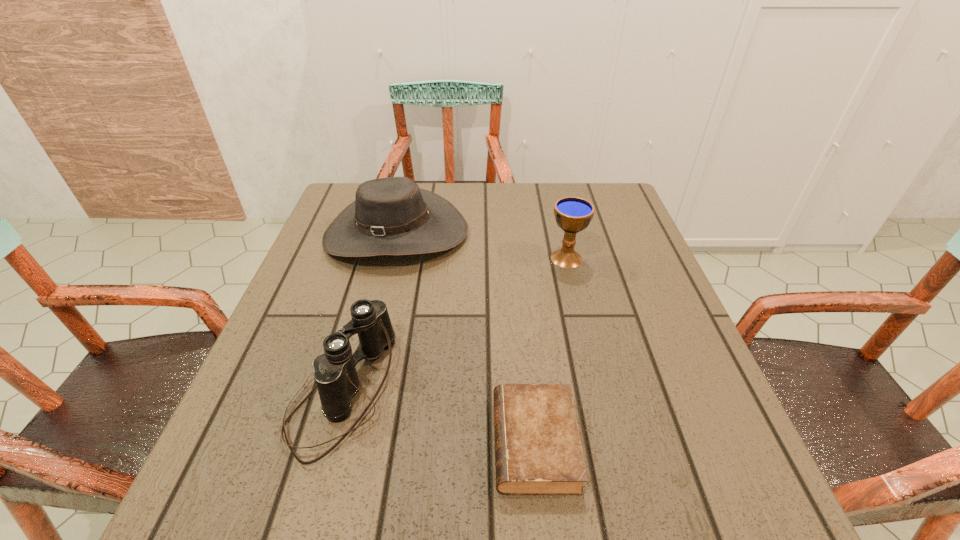
The width and height of the screenshot is (960, 540). Find the location of `free space located on the spine side of the shortest object`. free space located on the spine side of the shortest object is located at coordinates (256, 443).

Where is `object that is at the far edge`? This screenshot has width=960, height=540. object that is at the far edge is located at coordinates (392, 216).

Image resolution: width=960 pixels, height=540 pixels. In order to click on object located in the near edge section of the desktop in this screenshot , I will do `click(538, 451)`.

At what (x,y) coordinates should I click in order to perform the action: click on cowboy hat located in the left edge section of the desktop. Please return your answer as a coordinate pair (x, y). Looking at the image, I should click on (392, 216).

Where is `binoculars located at the left edge`? binoculars located at the left edge is located at coordinates (334, 371).

Image resolution: width=960 pixels, height=540 pixels. I want to click on object that is at the right edge, so click(573, 214).

The width and height of the screenshot is (960, 540). In order to click on object that is at the far left corner in this screenshot , I will do `click(392, 216)`.

In order to click on vacant space at the far edge in this screenshot , I will do `click(457, 189)`.

Locate an element on the screen. The height and width of the screenshot is (540, 960). free region at the left edge of the desktop is located at coordinates (362, 266).

Identify the location of free space at the right edge. This screenshot has width=960, height=540. (598, 230).